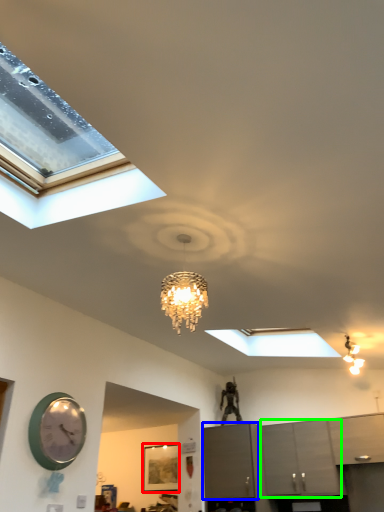
Question: Which is farther away from picture frame (highlighted by a red box)? cabinetry (highlighted by a blue box) or cabinetry (highlighted by a green box)?

Choices:
 (A) cabinetry
 (B) cabinetry

Answer: (B)